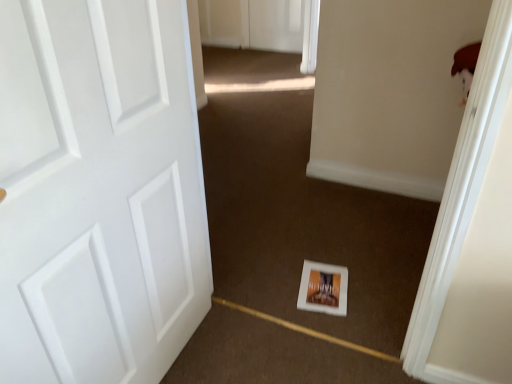
In order to click on vacant area on the back side of white matte postcard at center in this screenshot , I will do `click(330, 252)`.